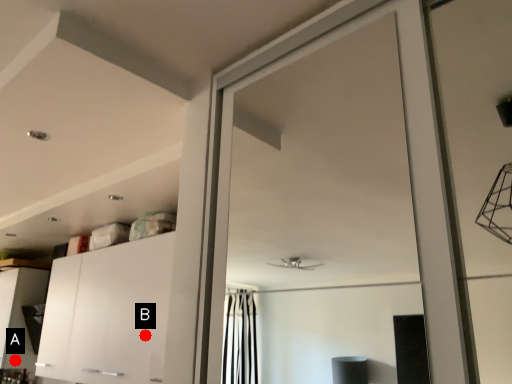
Question: Two points are circled on the image, labeled by A and B beside each circle. Which point is closer to the camera?

Choices:
 (A) A is closer
 (B) B is closer

Answer: (B)